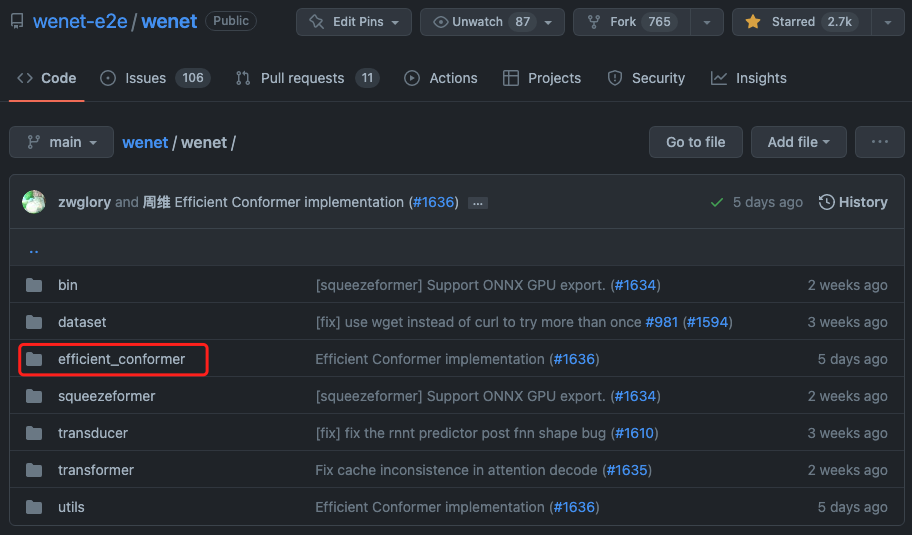
Locate an element on the screen. This screenshot has width=912, height=535. file folders is located at coordinates (26, 286), (29, 325), (40, 360), (39, 393), (38, 432), (40, 512), (38, 471).